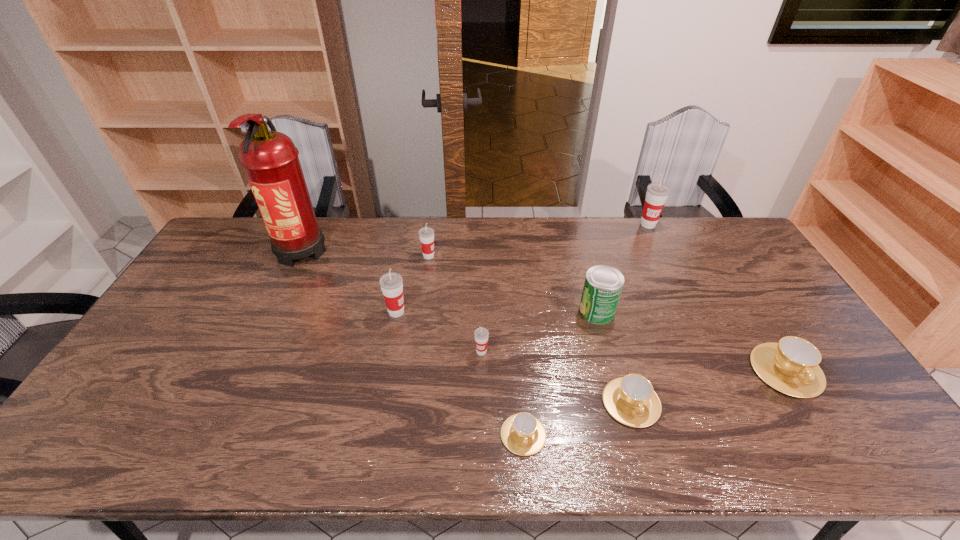
This screenshot has height=540, width=960. I want to click on blank space located on the side of the second smallest red cup with the logo, so click(485, 256).

Identify the location of free point located on the left of the green can. This screenshot has width=960, height=540. (543, 310).

Identify the location of free spot located on the side of the fourth tallest cup with the logo. (482, 424).

Where is `free region located with the handle on the side of the rightmost brown cup`? This screenshot has height=540, width=960. free region located with the handle on the side of the rightmost brown cup is located at coordinates point(820,425).

You are a GUI agent. You are given a task and a screenshot of the screen. Output one action in this format:
    pyautogui.click(x=<x>, y=<y>)
    Task: Click on the fire extinguisher located in the far edge section of the desktop
    This screenshot has height=540, width=960.
    Given the screenshot: What is the action you would take?
    pyautogui.click(x=270, y=159)

You are a GUI agent. You are given a task and a screenshot of the screen. Output one action in this format:
    pyautogui.click(x=<x>, y=<y>)
    Task: Click on the object that is at the right edge
    Image resolution: width=960 pixels, height=540 pixels.
    Given the screenshot: What is the action you would take?
    coord(791,366)

The height and width of the screenshot is (540, 960). In order to click on blank space at the far edge of the desktop in this screenshot , I will do 536,228.

This screenshot has height=540, width=960. Identify the location of vacant space at the near edge. (736, 454).

This screenshot has height=540, width=960. What are the coordinates of `vacant space at the left edge` in the screenshot? It's located at (115, 414).

The image size is (960, 540). In order to click on vacant region at the right edge of the desktop in this screenshot , I will do `click(744, 262)`.